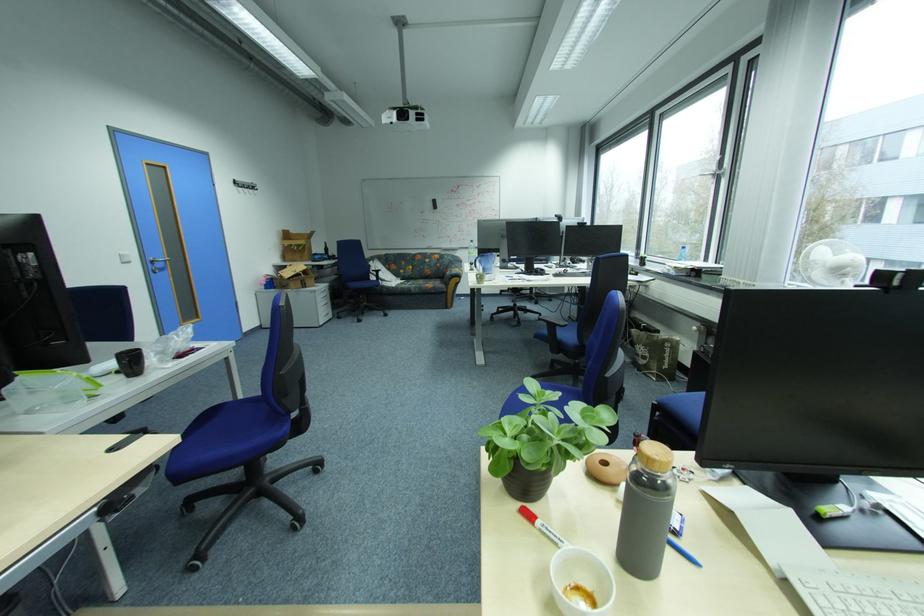
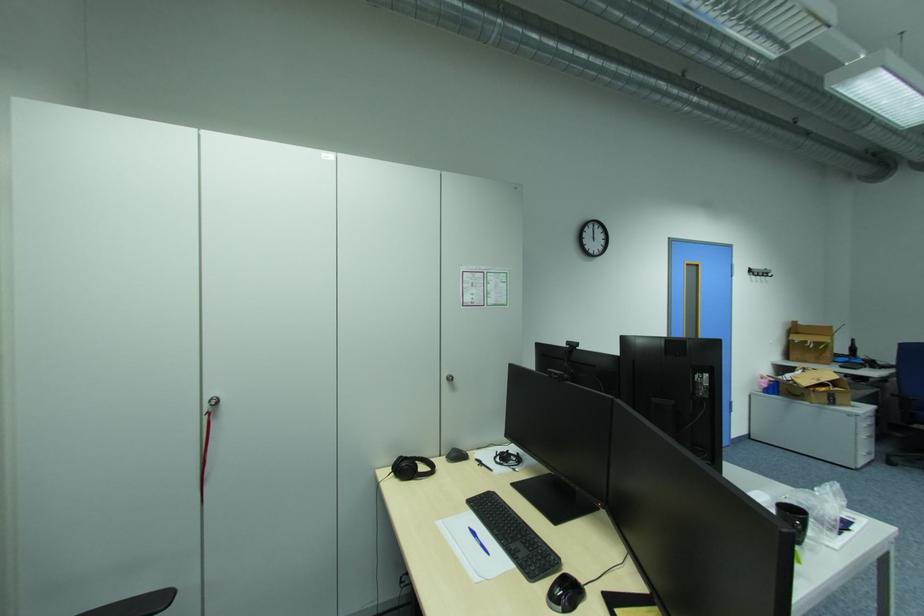
In the second image, find the point that corresponds to the point at 332,254 in the first image.

(855, 354)